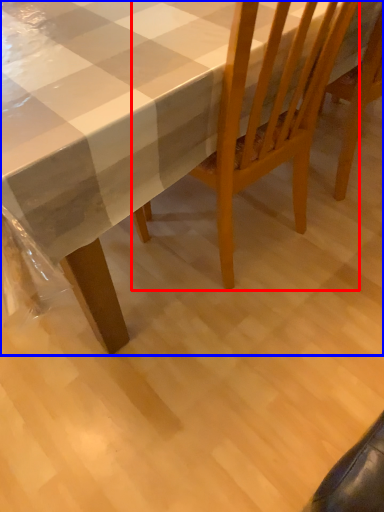
Question: Which of the following is the closest to the observer, chair (highlighted by a red box) or table (highlighted by a blue box)?

Choices:
 (A) chair
 (B) table

Answer: (B)